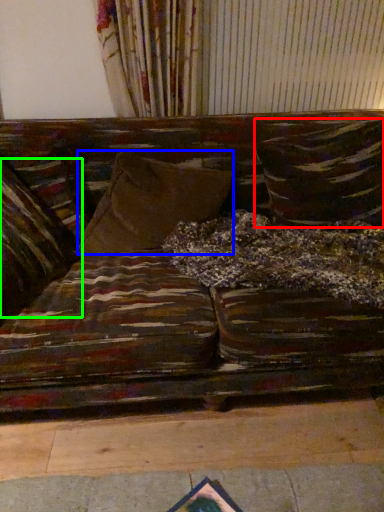
Question: Which object is positioned farthest from pillow (highlighted by a red box)? Select from pillow (highlighted by a blue box) and pillow (highlighted by a green box).

Choices:
 (A) pillow
 (B) pillow

Answer: (B)